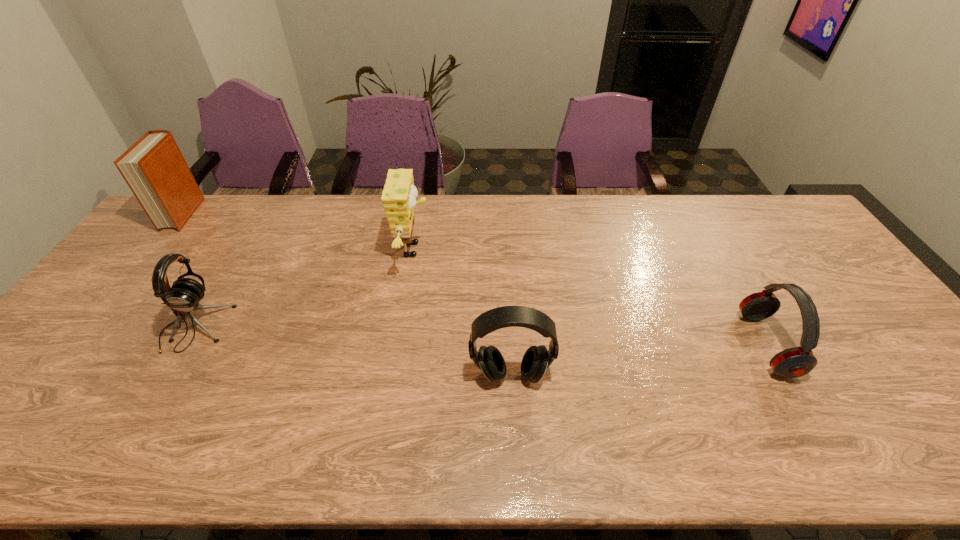
The height and width of the screenshot is (540, 960). What are the coordinates of `the leftmost object` in the screenshot? It's located at pos(154,168).

This screenshot has height=540, width=960. Identify the location of the third object from right to left. (399, 195).

Locate an element on the screen. The height and width of the screenshot is (540, 960). the second object from left to right is located at coordinates (184, 296).

Identify the location of the second earphone from right to left. (537, 359).

Identify the location of the rightmost object. This screenshot has height=540, width=960. (794, 362).

Identify the location of the shortest earphone. Image resolution: width=960 pixels, height=540 pixels. (794, 362).

Image resolution: width=960 pixels, height=540 pixels. I want to click on vacant point located on the open cover of the leftmost object, so click(133, 276).

Identify the location of free space located on the front-facing side of the third object from right to left. (513, 249).

Where is `free space located 0.320m on the right of the second object from left to right`? free space located 0.320m on the right of the second object from left to right is located at coordinates (346, 328).

I want to click on vacant space situated on the ear cups of the second object from right to left, so click(x=514, y=418).